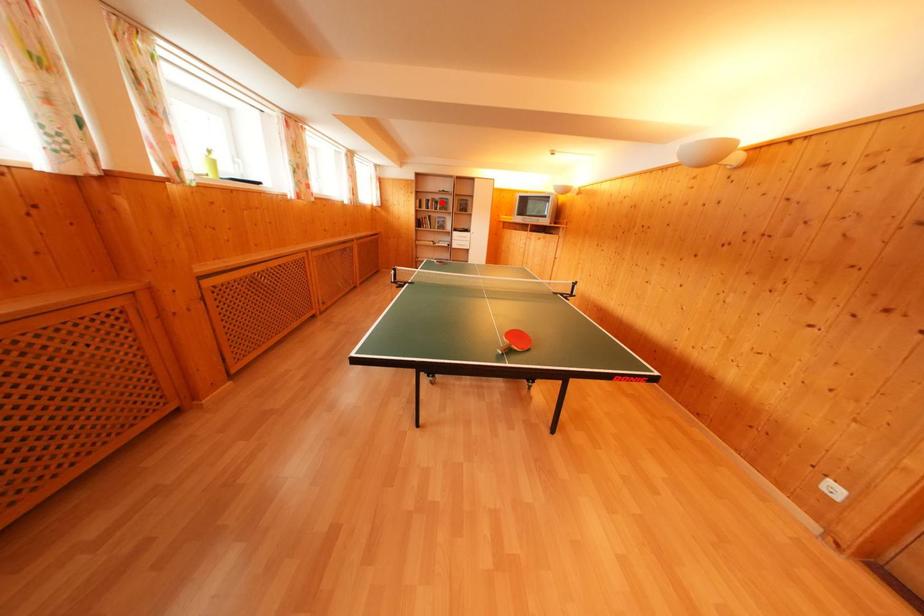
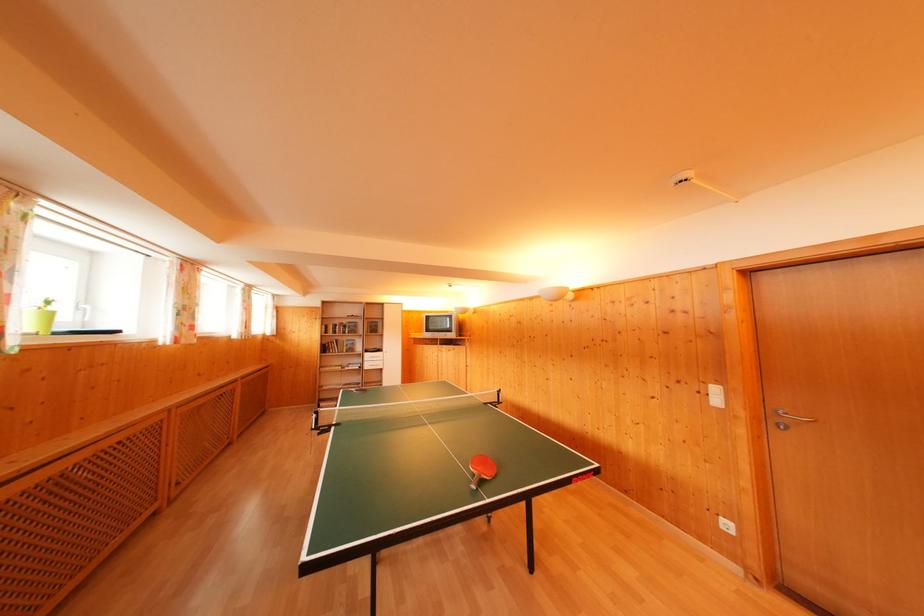
Question: I am providing you with two images of the same scene from different viewpoints. Image1 has a red point marked. In image2, the corresponding 3D location appears at what relative position? Reply with the corresponding letter.

Choices:
 (A) Closer
 (B) Farther

Answer: (B)